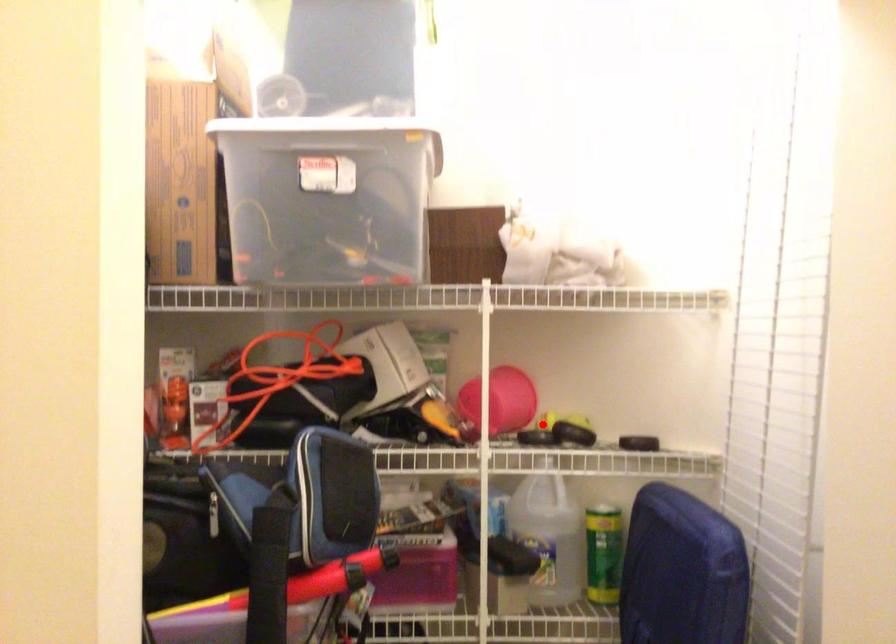
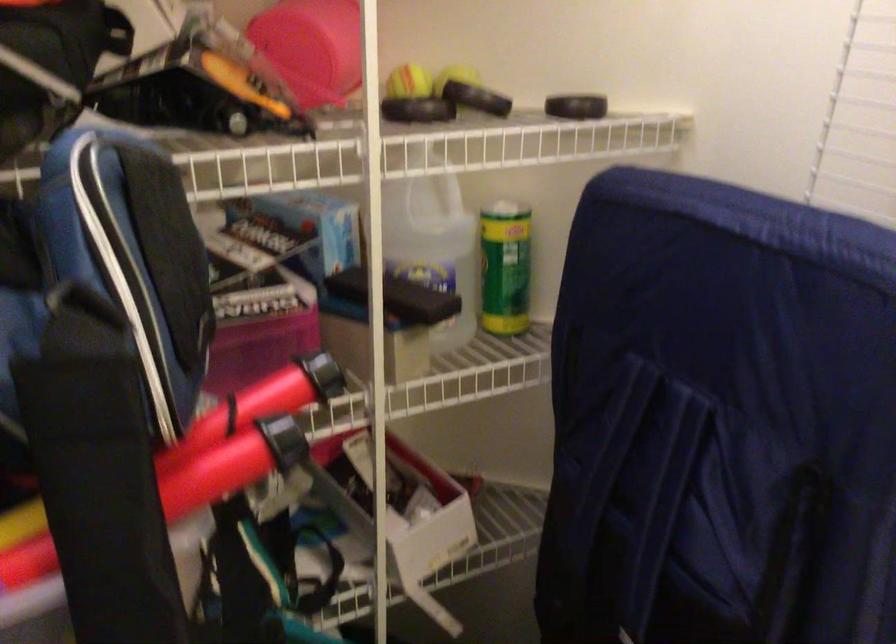
Question: A red point is marked in image1. In image2, is the corresponding 3D point closer to the camera or farther? Reply with the corresponding letter.

Choices:
 (A) The corresponding 3D point is closer.
 (B) The corresponding 3D point is farther.

Answer: (A)